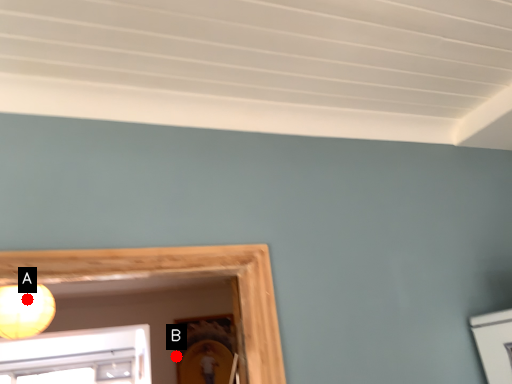
Question: Two points are circled on the image, labeled by A and B beside each circle. Which point is closer to the camera?

Choices:
 (A) A is closer
 (B) B is closer

Answer: (A)